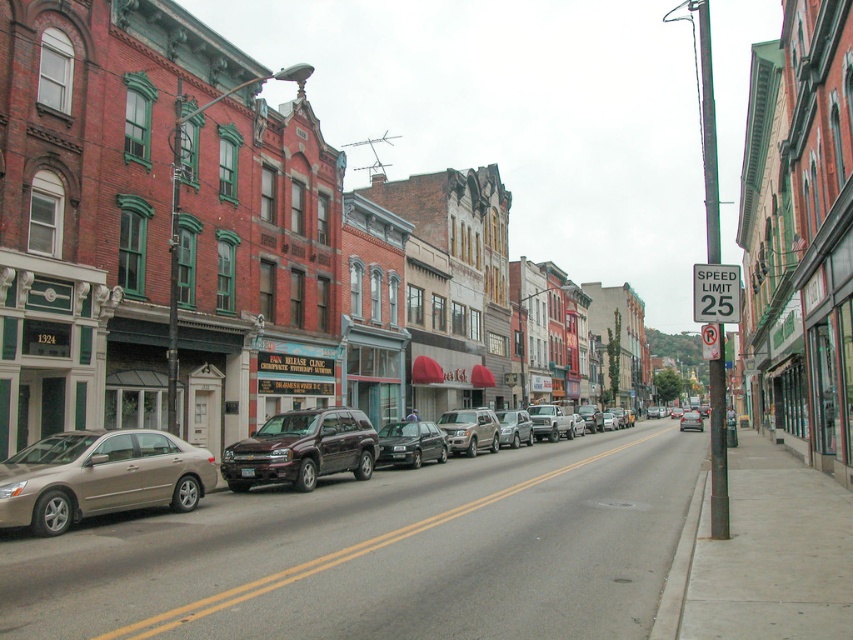
You are a pedestrian standing on the sidewalk on the right side of the street. You want to cross to the other side but need to check the distance between the gold metallic sedan at lower left and the satin gold suv at center. Which vehicle is nearer to you as you stand on the sidewalk?

The gold metallic sedan at lower left is closer to the viewer than the satin gold suv at center, so the gold metallic sedan at lower left is nearer to you as you stand on the sidewalk.

You are a delivery driver who needs to park your 5.5 meter long truck between the metallic silver car at center and the satin silver sedan at center. Can you fit your truck between them without overlapping either vehicle?

The metallic silver car at center and satin silver sedan at center are 8.79 meters apart from each other. Since your truck is 5.5 meters long, there is enough space to park between them without overlapping either vehicle.

You are a delivery person trying to park your van between the metallic silver car at center and the satin silver sedan at center. Can you fit your van that is 2 meters wide into the space between them?

The metallic silver car at center is positioned on the left side of satin silver sedan at center, but the distance between them isn not provided. Without knowing the exact width of the space, it is impossible to determine if the van will fit.